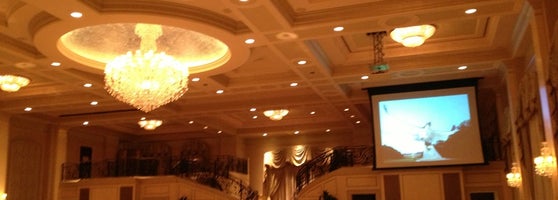
Identify the location of tv. Image resolution: width=558 pixels, height=200 pixels. (418, 125).